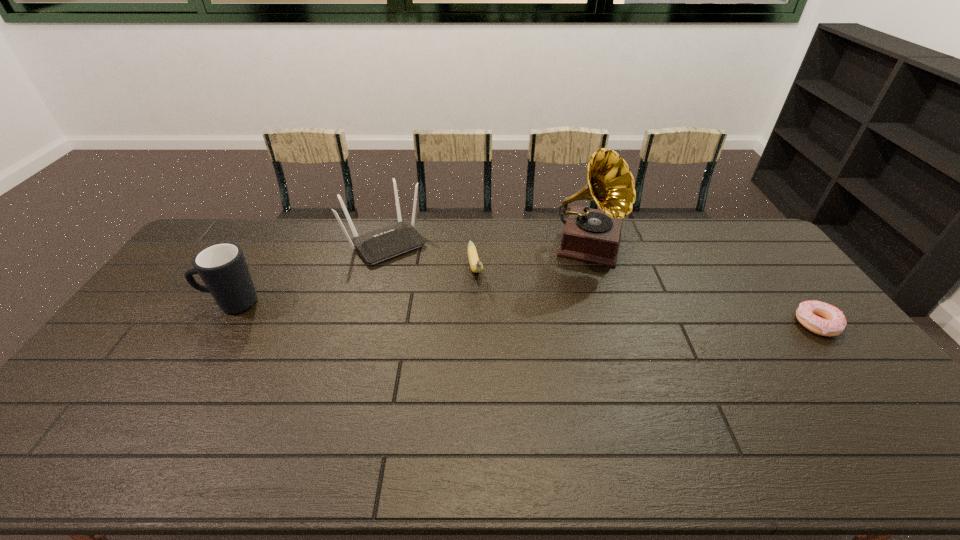
Find the location of a particular element. This screenshot has width=960, height=540. phonograph record at the far edge is located at coordinates (592, 235).

The image size is (960, 540). Identify the location of object that is at the left edge. (222, 267).

Image resolution: width=960 pixels, height=540 pixels. I want to click on object that is positioned at the right edge, so click(821, 318).

In the image, there is a desktop. Identify the location of vacant space at the far edge. The height and width of the screenshot is (540, 960). (517, 225).

In the image, there is a desktop. Find the location of `free space at the near edge`. free space at the near edge is located at coordinates (804, 397).

Find the location of a particular element. The height and width of the screenshot is (540, 960). vacant area at the right edge of the desktop is located at coordinates (747, 272).

In the image, there is a desktop. At what (x,y) coordinates should I click in order to perform the action: click on vacant space at the far left corner. Please return your answer as a coordinate pair (x, y). The height and width of the screenshot is (540, 960). Looking at the image, I should click on (236, 235).

Locate an element on the screen. This screenshot has height=540, width=960. blank region between the router and the shortest object is located at coordinates (601, 283).

The width and height of the screenshot is (960, 540). In order to click on empty location between the rightmost object and the mug in this screenshot , I will do `click(523, 313)`.

Locate an element on the screen. vacant space in between the router and the leftmost object is located at coordinates (308, 273).